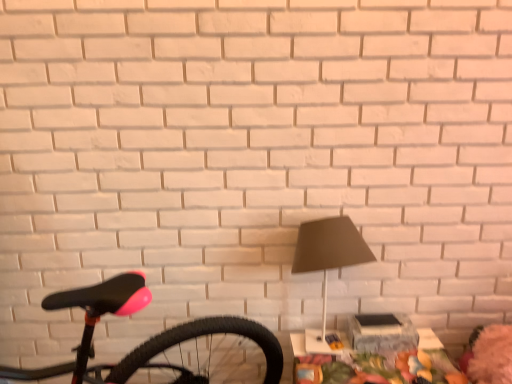
Question: Considering the positions of white glossy table at lower right and matte black lamp at center in the image, is white glossy table at lower right taller or shorter than matte black lamp at center?

Choices:
 (A) tall
 (B) short

Answer: (B)

Question: Looking at their shapes, would you say white glossy table at lower right is wider or thinner than matte black lamp at center?

Choices:
 (A) wide
 (B) thin

Answer: (A)

Question: Do you think white glossy table at lower right is within matte black lamp at center, or outside of it?

Choices:
 (A) outside
 (B) inside

Answer: (A)

Question: Considering the relative positions of matte black lamp at center and white glossy table at lower right in the image provided, is matte black lamp at center to the left or to the right of white glossy table at lower right?

Choices:
 (A) right
 (B) left

Answer: (B)

Question: Looking at the image, does matte black lamp at center seem bigger or smaller compared to white glossy table at lower right?

Choices:
 (A) small
 (B) big

Answer: (A)

Question: Relative to white glossy table at lower right, is matte black lamp at center in front or behind?

Choices:
 (A) behind
 (B) front

Answer: (B)

Question: Is point 298,233 positioned closer to the camera than point 434,375?

Choices:
 (A) closer
 (B) farther

Answer: (B)